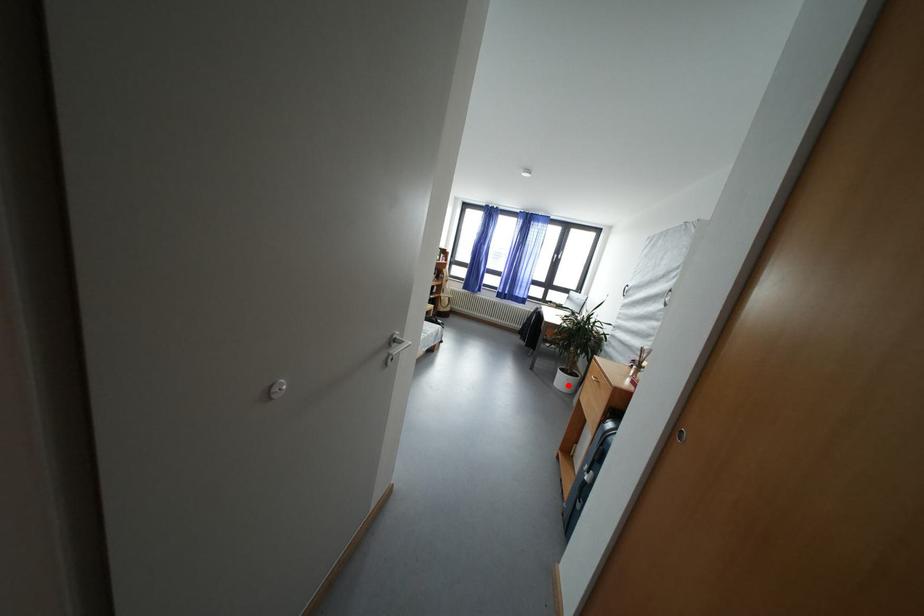
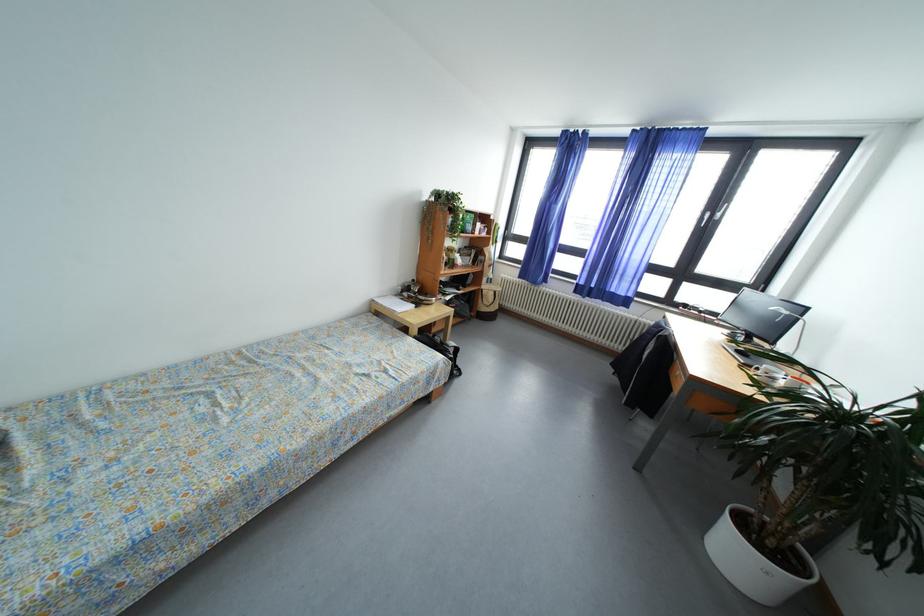
Where in the second image is the point corresponding to the highlighted location from the first image?

(745, 561)